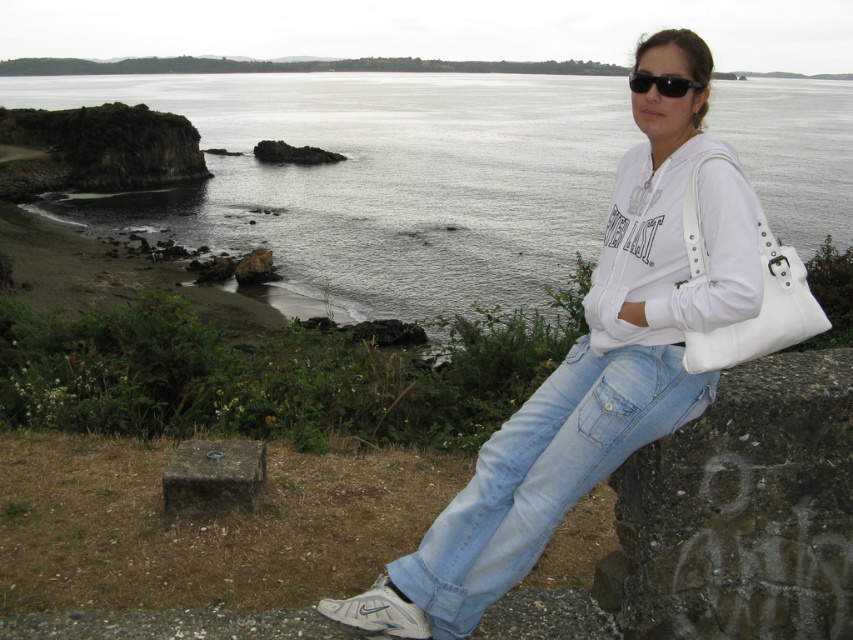
You are a photographer standing at the point marked as point (379,179). You want to capture a photo of the gray water at upper center. Since you are at that point, can you directly see the gray water at upper center in your camera view?

Yes, the point (379,179) directly indicates the location of the gray water at upper center, so you can directly see it in your camera view.

You are a photographer positioned at the point with coordinates point (592, 368). You want to capture a photo of the white matte hoodie at upper right. Is the point you are standing at the correct location to take the photo?

Yes, the point (592, 368) corresponds to the white matte hoodie at upper right, so standing there would allow you to take the photo.

You are a photographer planning to take a wide shot of the coastal scene. The gray water at upper center and dark gray stone at lower center are both in your frame. Based on their sizes in the image, which object would appear more prominent in the photo?

The gray water at upper center would appear more prominent in the photo because it has a larger size compared to the dark gray stone at lower center.